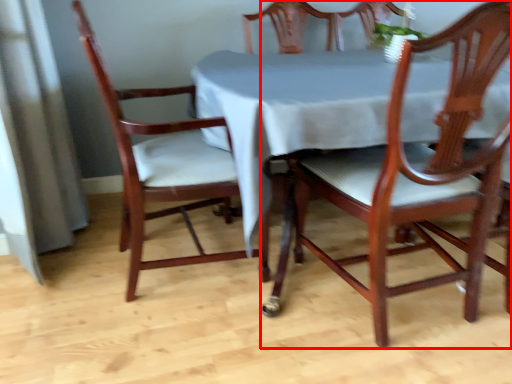
Question: Observing the image, what is the correct spatial positioning of chair (annotated by the red box) in reference to chair?

Choices:
 (A) left
 (B) right

Answer: (B)